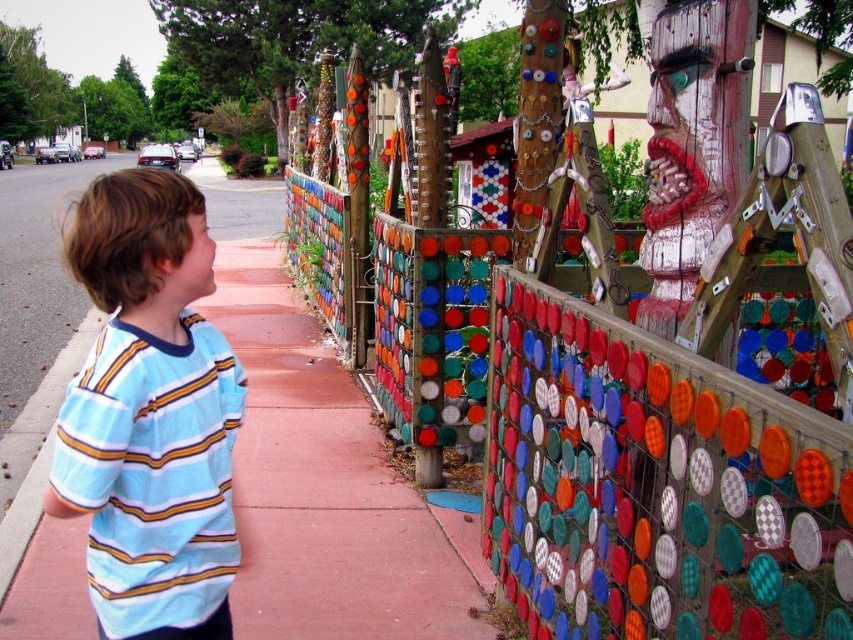
In the scene shown: Which is more to the left, pink concrete sidewalk at center or blue striped shirt at left?

pink concrete sidewalk at center is more to the left.

Does pink concrete sidewalk at center appear over blue striped shirt at left?

Yes.

Where is `pink concrete sidewalk at center`? pink concrete sidewalk at center is located at coordinates (322, 465).

Which of these two, multicolored mosaic fence at center or pink concrete sidewalk at center, stands shorter?

multicolored mosaic fence at center is shorter.

From the picture: Is multicolored mosaic fence at center shorter than pink concrete sidewalk at center?

Yes, multicolored mosaic fence at center is shorter than pink concrete sidewalk at center.

Is point (624, 637) positioned behind point (67, 536)?

No, (624, 637) is closer to viewer.

Where is `multicolored mosaic fence at center`? This screenshot has width=853, height=640. multicolored mosaic fence at center is located at coordinates (627, 461).

Which is more to the right, multicolored mosaic fence at center or blue striped shirt at left?

multicolored mosaic fence at center is more to the right.

Between point (460, 346) and point (105, 579), which one is positioned behind?

The point (460, 346) is more distant.

Where is `multicolored mosaic fence at center`? The height and width of the screenshot is (640, 853). multicolored mosaic fence at center is located at coordinates (627, 461).

Locate an element on the screen. multicolored mosaic fence at center is located at coordinates (627, 461).